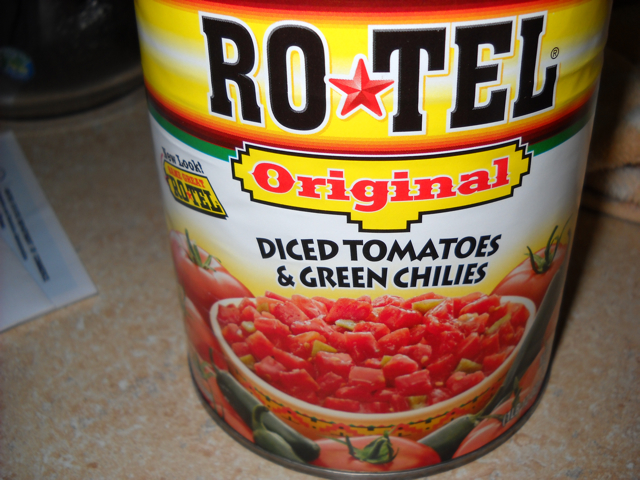
Identify the location of table. Image resolution: width=640 pixels, height=480 pixels. (141, 259).